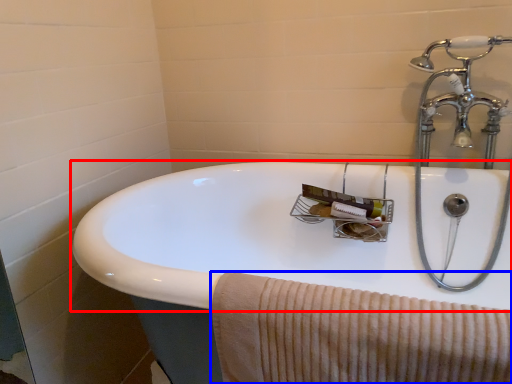
Question: Which object appears farthest to the camera in this image, sink (highlighted by a red box) or bath towel (highlighted by a blue box)?

Choices:
 (A) sink
 (B) bath towel

Answer: (B)